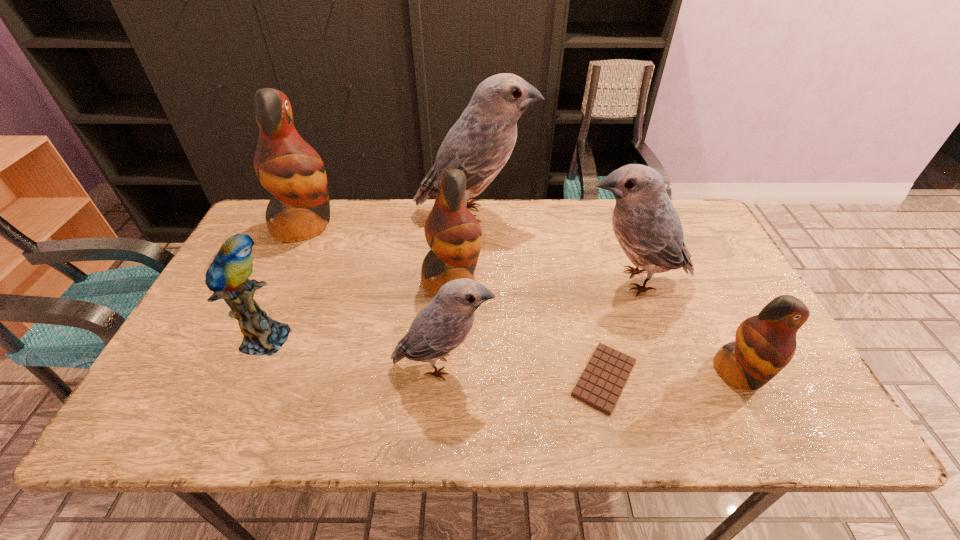
Identify the location of the farthest gray parrot. The image size is (960, 540). (480, 143).

I want to click on the biggest red parrot, so click(286, 165).

The height and width of the screenshot is (540, 960). In order to click on the leftmost red parrot in this screenshot , I will do `click(286, 165)`.

Find the location of `the second nearest red parrot`. the second nearest red parrot is located at coordinates (454, 235).

Where is `the second biggest red parrot`? This screenshot has width=960, height=540. the second biggest red parrot is located at coordinates (454, 235).

Image resolution: width=960 pixels, height=540 pixels. Find the location of `the rightmost gray parrot`. the rightmost gray parrot is located at coordinates (648, 228).

Where is `the second nearest gray parrot`? The width and height of the screenshot is (960, 540). the second nearest gray parrot is located at coordinates (648, 228).

Find the location of a particular element. the nearest gray parrot is located at coordinates (440, 327).

Find the location of a particular element. This screenshot has height=540, width=960. the rightmost red parrot is located at coordinates (764, 344).

Where is `the smallest red parrot`? the smallest red parrot is located at coordinates (764, 344).